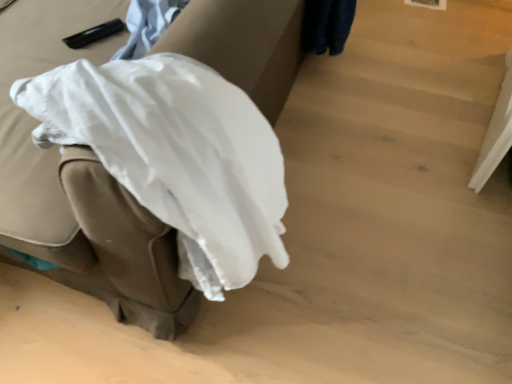
Locate an element on the screen. Image resolution: width=512 pixels, height=384 pixels. white fabric at center is located at coordinates (116, 253).

Describe the element at coordinates (116, 253) in the screenshot. The image size is (512, 384). I see `white fabric at center` at that location.

You are a GUI agent. You are given a task and a screenshot of the screen. Output one action in this format:
    pyautogui.click(x=<x>, y=<y>)
    Task: Click on the white fabric at center
    Image resolution: width=512 pixels, height=384 pixels.
    Given the screenshot: What is the action you would take?
    pyautogui.click(x=116, y=253)